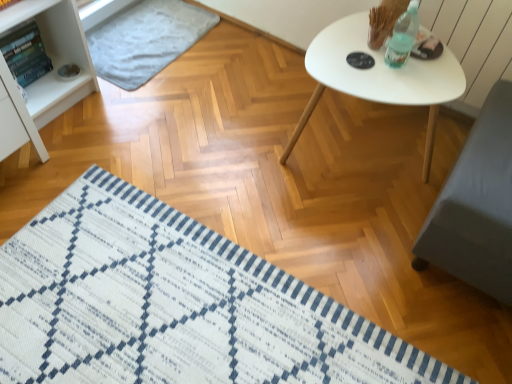
Question: Would you say white matte table at upper right is inside or outside white woven mat at lower left, marked as the 2th mat in a back-to-front arrangement?

Choices:
 (A) outside
 (B) inside

Answer: (A)

Question: Based on their sizes in the image, would you say white matte table at upper right is bigger or smaller than white woven mat at lower left, which ranks as the first mat in bottom-to-top order?

Choices:
 (A) big
 (B) small

Answer: (A)

Question: Considering the real-world distances, which object is farthest from the white matte table at upper right?

Choices:
 (A) light gray textured mat at upper left, acting as the first mat starting from the back
 (B) white woven mat at lower left, the first mat when ordered from front to back

Answer: (A)

Question: Considering the real-world distances, which object is closest to the light gray textured mat at upper left, positioned as the 1th mat in top-to-bottom order?

Choices:
 (A) white matte table at upper right
 (B) white woven mat at lower left, the first mat when ordered from front to back

Answer: (A)